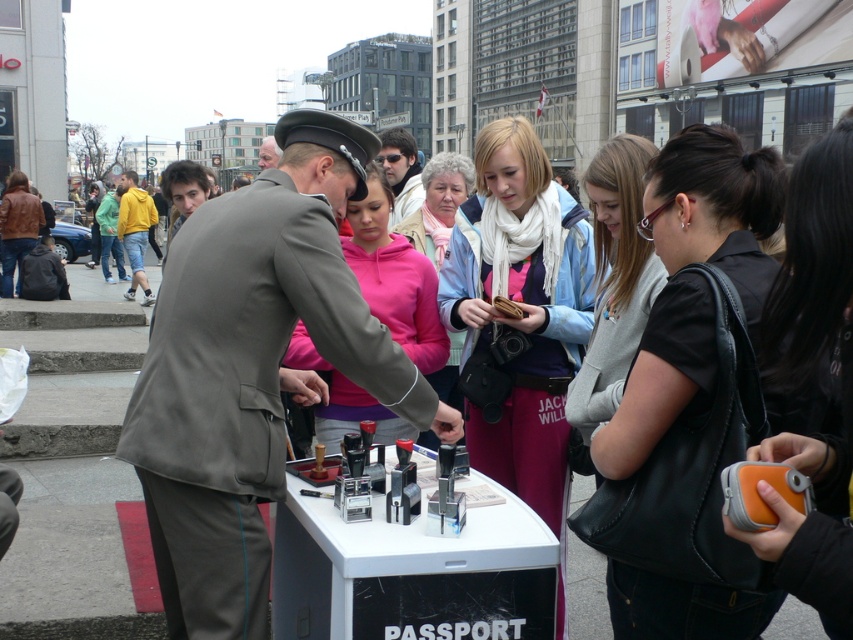
Is gray fabric uniform at center taller than black leather purse at center?

Yes.

Who is more forward, (184, 346) or (701, 246)?

Positioned in front is point (701, 246).

Where is `gray fabric uniform at center`? The image size is (853, 640). gray fabric uniform at center is located at coordinates (252, 371).

Between gray fabric uniform at center and matte pink hoodie at center, which one appears on the left side from the viewer's perspective?

From the viewer's perspective, gray fabric uniform at center appears more on the left side.

Does gray fabric uniform at center have a greater height compared to matte pink hoodie at center?

Yes, gray fabric uniform at center is taller than matte pink hoodie at center.

Is point (186, 358) in front of point (381, 291)?

Yes, it is in front of point (381, 291).

At what (x,y) coordinates should I click in order to perform the action: click on gray fabric uniform at center. Please return your answer as a coordinate pair (x, y). The width and height of the screenshot is (853, 640). Looking at the image, I should click on (252, 371).

Which is below, black leather purse at center or orange fabric camera at center?

Positioned lower is orange fabric camera at center.

This screenshot has width=853, height=640. In order to click on black leather purse at center in this screenshot , I will do `click(715, 202)`.

What do you see at coordinates (715, 202) in the screenshot? I see `black leather purse at center` at bounding box center [715, 202].

The height and width of the screenshot is (640, 853). I want to click on black leather purse at center, so click(x=715, y=202).